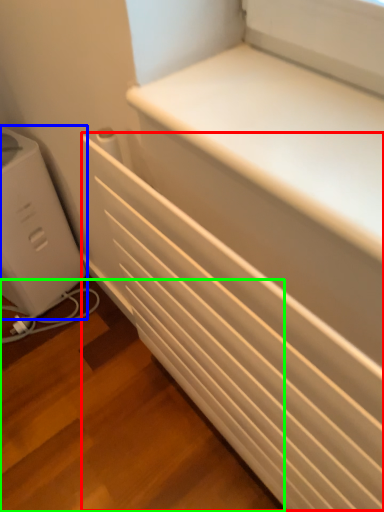
Question: Estimate the real-world distances between objects in this image. Which object is closer to radiator (highlighted by a red box), home appliance (highlighted by a blue box) or stairwell (highlighted by a green box)?

Choices:
 (A) home appliance
 (B) stairwell

Answer: (B)